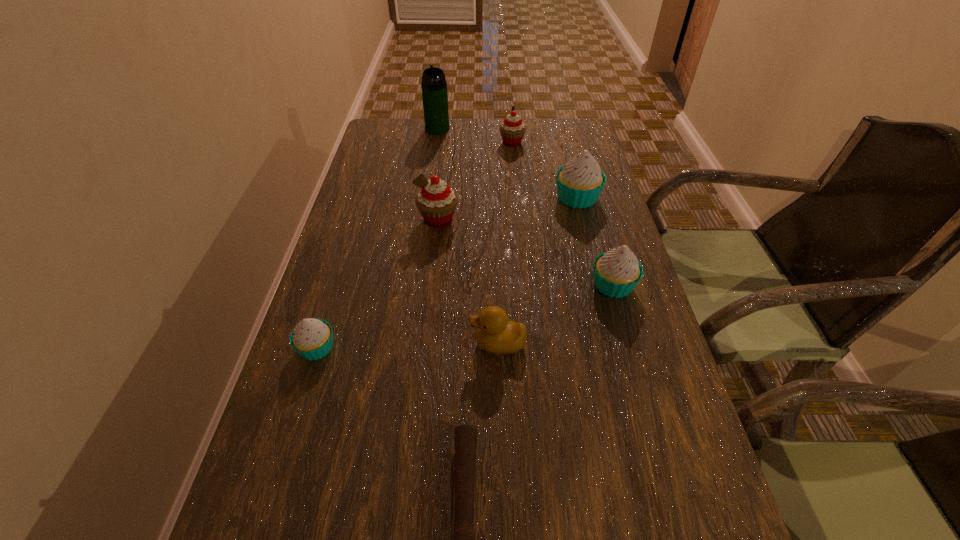
The image size is (960, 540). Find the location of `the leftmost white cupcake`. the leftmost white cupcake is located at coordinates (312, 339).

Identify the location of the leftmost cupcake. (312, 339).

Identify the location of free location located 0.310m from the spout of the tallest object. (429, 187).

Locate an element on the screen. vacant space situated on the back of the left pink cupcake is located at coordinates (442, 186).

Find the location of a particular element. vacant space located 0.390m on the back of the biggest white cupcake is located at coordinates (558, 122).

Where is `free space located 0.060m on the back of the farther pink cupcake`? This screenshot has width=960, height=540. free space located 0.060m on the back of the farther pink cupcake is located at coordinates (511, 127).

Locate an element on the screen. The height and width of the screenshot is (540, 960). vacant space located 0.210m on the front of the fourth nearest object is located at coordinates (642, 387).

Where is `vacant space situated on the face of the duckling`? Image resolution: width=960 pixels, height=540 pixels. vacant space situated on the face of the duckling is located at coordinates (445, 344).

Identify the location of vacant space located 0.260m on the face of the duckling. The width and height of the screenshot is (960, 540). (344, 344).

This screenshot has width=960, height=540. Identify the location of vacant region located on the face of the duckling. (402, 344).